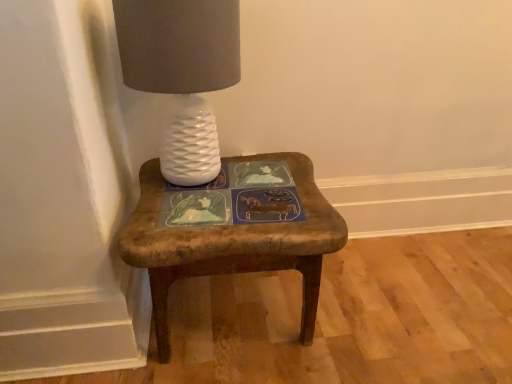
Identify the location of vacant area that lies in front of white textured lamp at upper left. pyautogui.click(x=200, y=226).